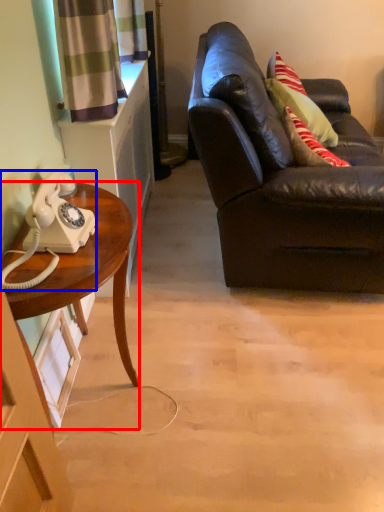
Question: Among these objects, which one is nearest to the camera, desk (highlighted by a red box) or corded phone (highlighted by a blue box)?

Choices:
 (A) desk
 (B) corded phone

Answer: (B)